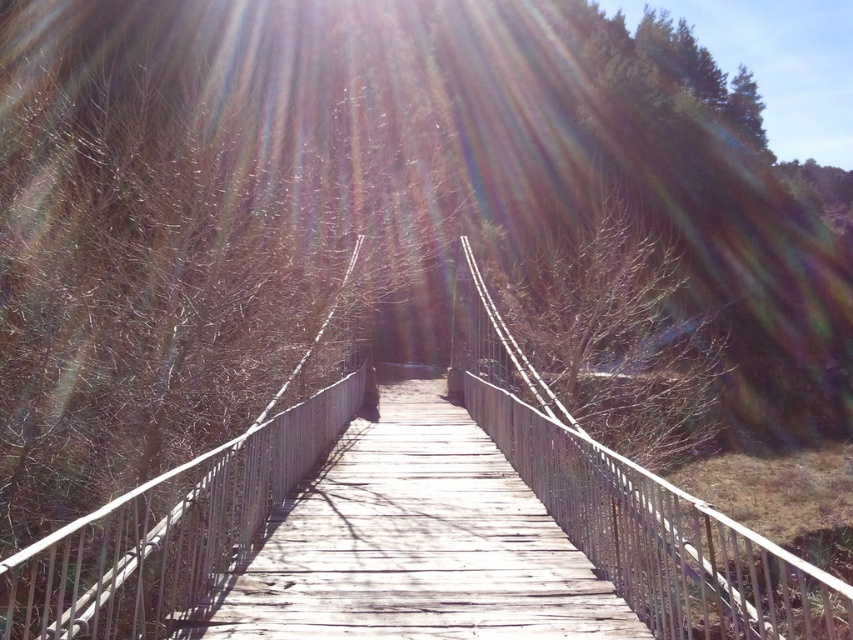
You are a hiker standing on the wooden suspension bridge and want to take a photo of the wooden at center and the bare branches at center. Which object will appear closer to the camera in your photo?

The wooden at center will appear closer to the camera because it is shorter than the bare branches at center, making it visually nearer in the photo.

You are a hiker carrying a backpack and need to cross the wooden at center and the weathered wood bridge at center. The bridge can only support a total weight of 4 meters. Can you safely cross the bridge with your gear?

The wooden at center and weathered wood bridge at center are 3.85 meters apart from each other. Since the bridge can support 4 meters, the total distance between them is within the limit, so you can safely cross with your gear.